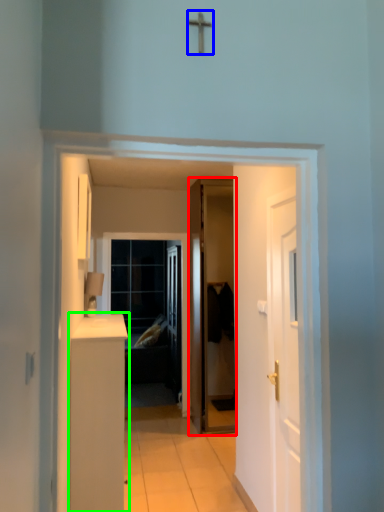
Question: Which object is the farthest from door (highlighted by a red box)? Choose among these: crucifix (highlighted by a blue box) or cabinetry (highlighted by a green box).

Choices:
 (A) crucifix
 (B) cabinetry

Answer: (A)